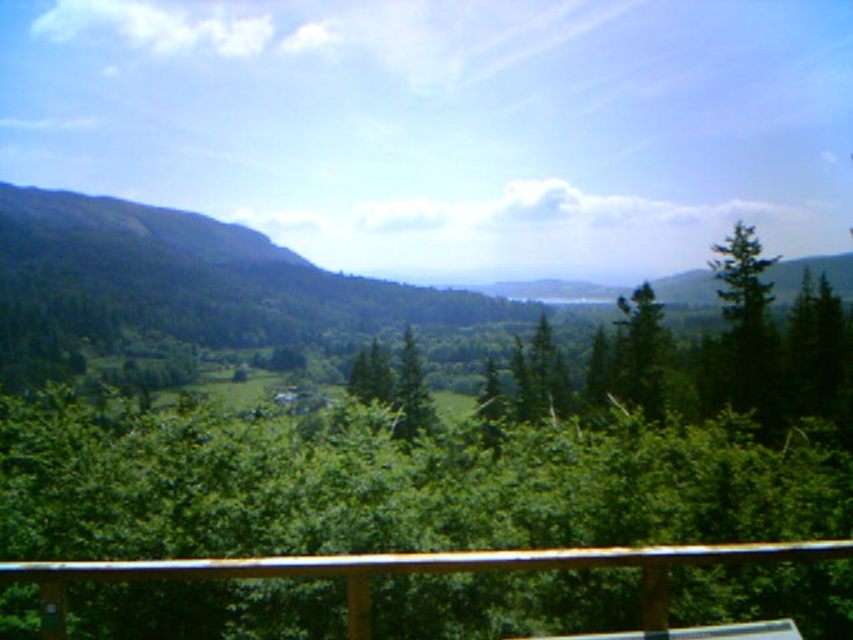
Consider the image. Who is shorter, brown wooden rail at lower center or green matte tree at right?

brown wooden rail at lower center is shorter.

Between point (622, 564) and point (735, 310), which one is positioned in front?

Point (622, 564)

Image resolution: width=853 pixels, height=640 pixels. Identify the location of brown wooden rail at lower center. (415, 572).

Between green matte tree at right and green matte tree at center, which one is positioned lower?

green matte tree at center

Is green matte tree at right to the left of green matte tree at center from the viewer's perspective?

No, green matte tree at right is not to the left of green matte tree at center.

Find the location of a particular element. The image size is (853, 640). green matte tree at right is located at coordinates (746, 330).

Between point (753, 250) and point (650, 406), which one is positioned in front?

Point (650, 406)

Measure the distance between point (717, 378) and camera.

A distance of 57.74 meters exists between point (717, 378) and camera.

What do you see at coordinates (746, 330) in the screenshot?
I see `green matte tree at right` at bounding box center [746, 330].

Locate an element on the screen. The width and height of the screenshot is (853, 640). green matte tree at right is located at coordinates (746, 330).